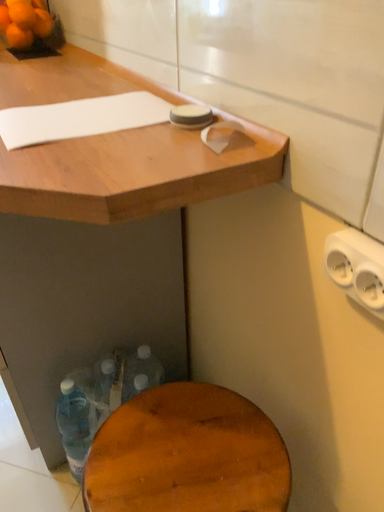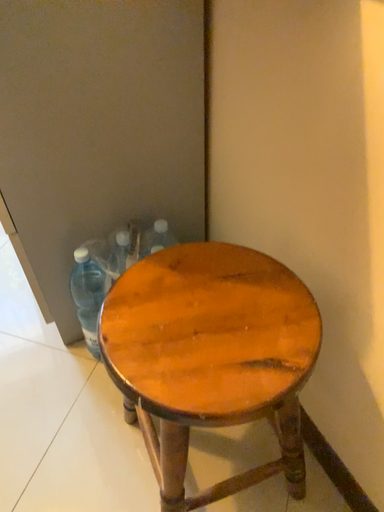
Question: Which way did the camera rotate in the video?

Choices:
 (A) rotated upward
 (B) rotated downward

Answer: (B)